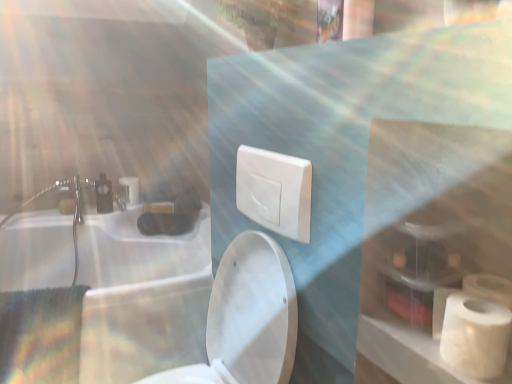
Question: Can you confirm if white matte toilet paper at right, arranged as the second toilet paper when viewed from the back, is positioned to the right of white matte toiletry bag at lower right?

Choices:
 (A) no
 (B) yes

Answer: (B)

Question: From a real-world perspective, is white matte toilet paper at right, the second toilet paper viewed from the left, below white matte toiletry bag at lower right?

Choices:
 (A) yes
 (B) no

Answer: (A)

Question: Can you confirm if white matte toilet paper at right, positioned as the first toilet paper in front-to-back order, is thinner than white matte toiletry bag at lower right?

Choices:
 (A) yes
 (B) no

Answer: (A)

Question: Can you confirm if white matte toilet paper at right, the second toilet paper viewed from the left, is taller than white matte toiletry bag at lower right?

Choices:
 (A) no
 (B) yes

Answer: (B)

Question: Does white matte toilet paper at right, the first toilet paper ordered from the bottom, have a greater width compared to white matte toiletry bag at lower right?

Choices:
 (A) yes
 (B) no

Answer: (B)

Question: Which is correct: white glossy sink at upper left is inside white matte toilet paper at right, the first toilet paper ordered from the bottom, or outside of it?

Choices:
 (A) inside
 (B) outside

Answer: (B)

Question: From the image's perspective, is white glossy sink at upper left located above or below white matte toilet paper at right, arranged as the second toilet paper when viewed from the back?

Choices:
 (A) above
 (B) below

Answer: (B)

Question: Visually, is white glossy sink at upper left positioned to the left or to the right of white matte toilet paper at right, arranged as the 2th toilet paper when viewed from the top?

Choices:
 (A) left
 (B) right

Answer: (A)

Question: Looking at their shapes, would you say white glossy sink at upper left is wider or thinner than white matte toilet paper at right, the first toilet paper when ordered from right to left?

Choices:
 (A) wide
 (B) thin

Answer: (A)

Question: Is white matte toilet paper at lower right, the first toilet paper viewed from the back, taller or shorter than matte white faucet at upper left?

Choices:
 (A) tall
 (B) short

Answer: (B)

Question: Looking at their shapes, would you say white matte toilet paper at lower right, positioned as the second toilet paper in front-to-back order, is wider or thinner than matte white faucet at upper left?

Choices:
 (A) thin
 (B) wide

Answer: (A)

Question: Is point (68, 200) positioned closer to the camera than point (134, 190)?

Choices:
 (A) closer
 (B) farther

Answer: (A)

Question: From the image's perspective, is white matte toilet paper at lower right, arranged as the second toilet paper when ordered from the bottom, above or below matte white faucet at upper left?

Choices:
 (A) below
 (B) above

Answer: (A)

Question: In the image, is white glossy toilet at center on the left side or the right side of white plastic switch at center?

Choices:
 (A) right
 (B) left

Answer: (B)

Question: Looking at the image, does white glossy toilet at center seem bigger or smaller compared to white plastic switch at center?

Choices:
 (A) small
 (B) big

Answer: (B)